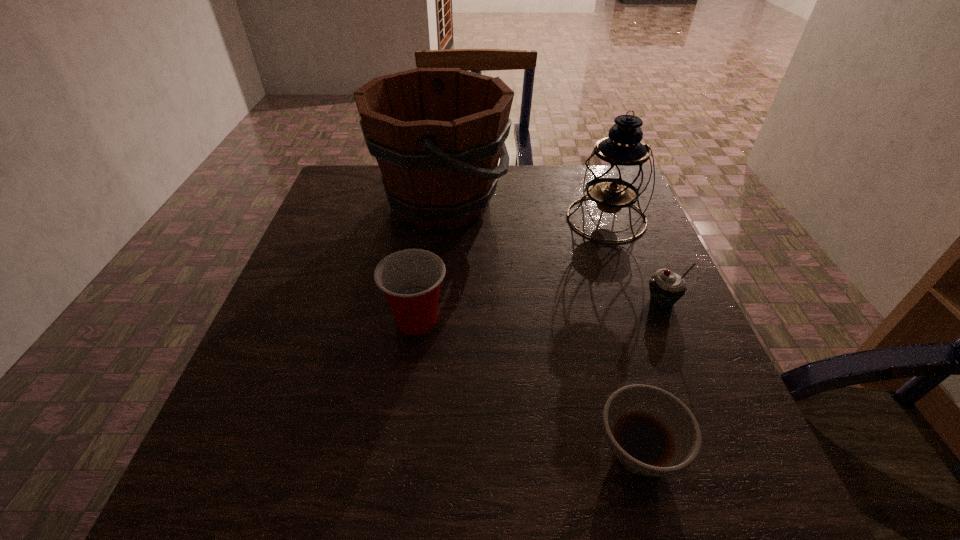
I want to click on bucket, so click(437, 134).

At what (x,y) coordinates should I click in order to perform the action: click on lantern. Please return your answer as a coordinate pair (x, y). Image resolution: width=960 pixels, height=540 pixels. Looking at the image, I should click on (618, 171).

Image resolution: width=960 pixels, height=540 pixels. In order to click on cup in this screenshot , I will do `click(410, 279)`.

Identify the location of the second shortest object. Image resolution: width=960 pixels, height=540 pixels. (666, 288).

Locate an element on the screen. This screenshot has width=960, height=540. the nearest object is located at coordinates 651,432.

Locate an element on the screen. This screenshot has width=960, height=540. soup bowl is located at coordinates (651, 432).

You are a GUI agent. You are given a task and a screenshot of the screen. Output one action in this format:
    pyautogui.click(x=<x>, y=<y>)
    Task: Click on the vacant region located 0.180m on the handle side of the bucket
    Image resolution: width=960 pixels, height=540 pixels.
    Given the screenshot: What is the action you would take?
    pyautogui.click(x=572, y=203)

Identify the location of vacant space situated 0.190m on the front-facing side of the lantern. This screenshot has height=540, width=960. (635, 296).

You are a GUI agent. You are given a task and a screenshot of the screen. Output one action in this format:
    pyautogui.click(x=<x>, y=<y>)
    Task: Click on the vacant space located on the left of the cup
    
    Given the screenshot: What is the action you would take?
    pyautogui.click(x=275, y=320)

Find the location of a particular element. The image size is (960, 540). vacant space located 0.050m on the back of the second shortest object is located at coordinates pos(650,273).